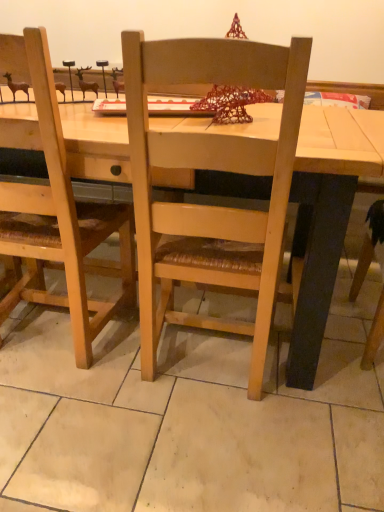
Find the location of a particular element. free space between natural wood chair at center and light wood table at center is located at coordinates (153, 386).